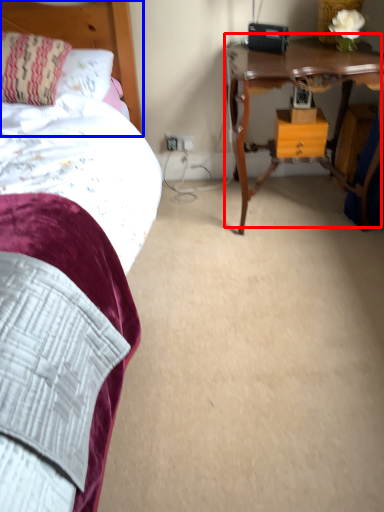
Question: Among these objects, which one is farthest to the camera, table (highlighted by a red box) or headboard (highlighted by a blue box)?

Choices:
 (A) table
 (B) headboard

Answer: (B)